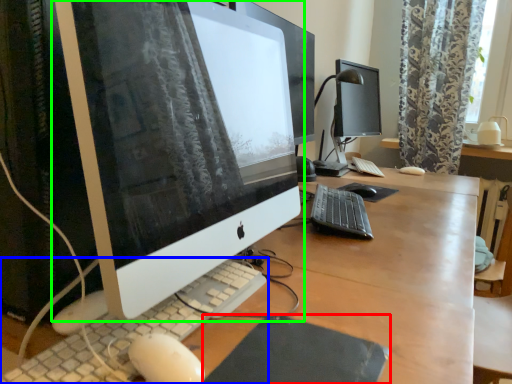
Question: Based on their relative distances, which object is farther from mousepad (highlighted by a red box)? Choose from computer keyboard (highlighted by a blue box) and computer monitor (highlighted by a green box).

Choices:
 (A) computer keyboard
 (B) computer monitor

Answer: (B)